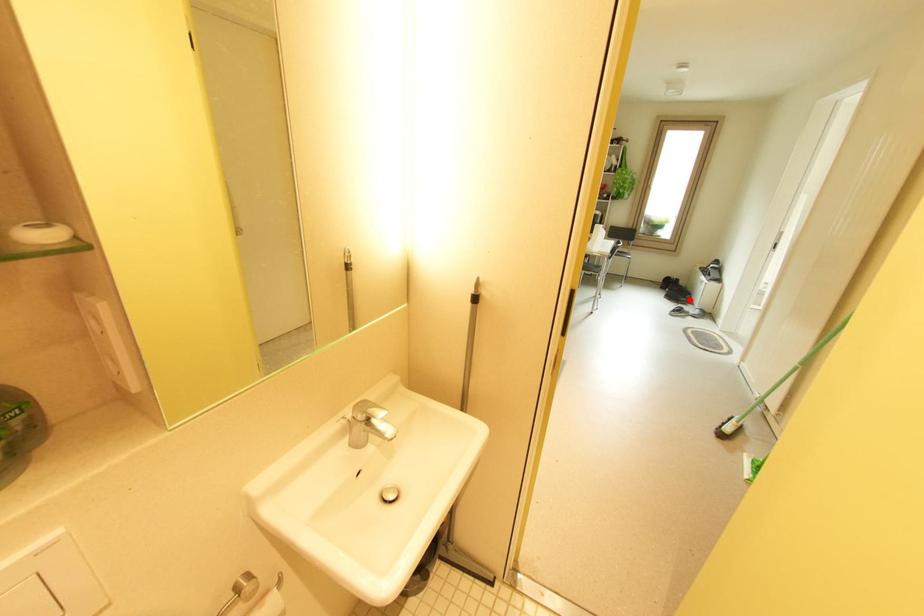
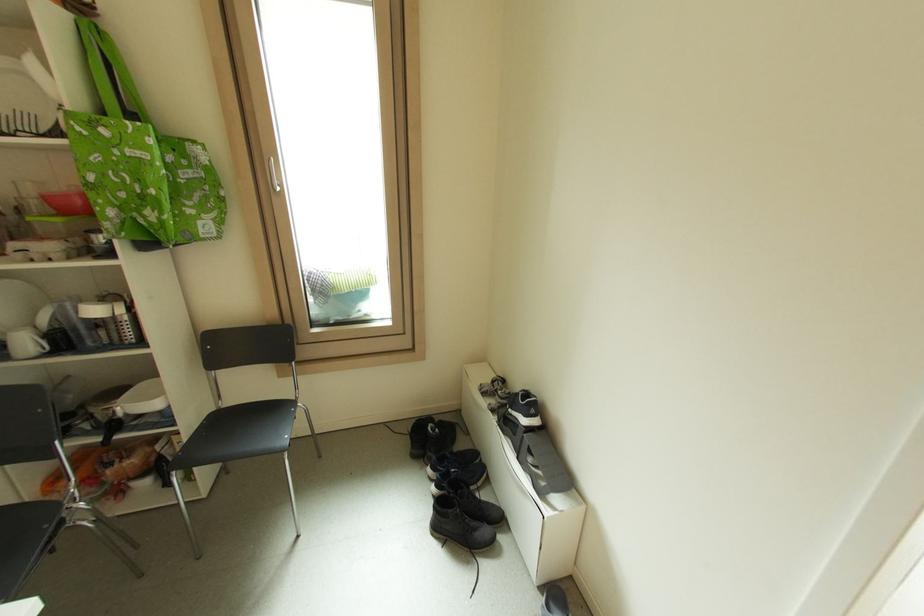
Question: A red point is marked in image1. In image2, is the corresponding 3D point closer to the camera or farther? Reply with the corresponding letter.

Choices:
 (A) The corresponding 3D point is closer.
 (B) The corresponding 3D point is farther.

Answer: (B)